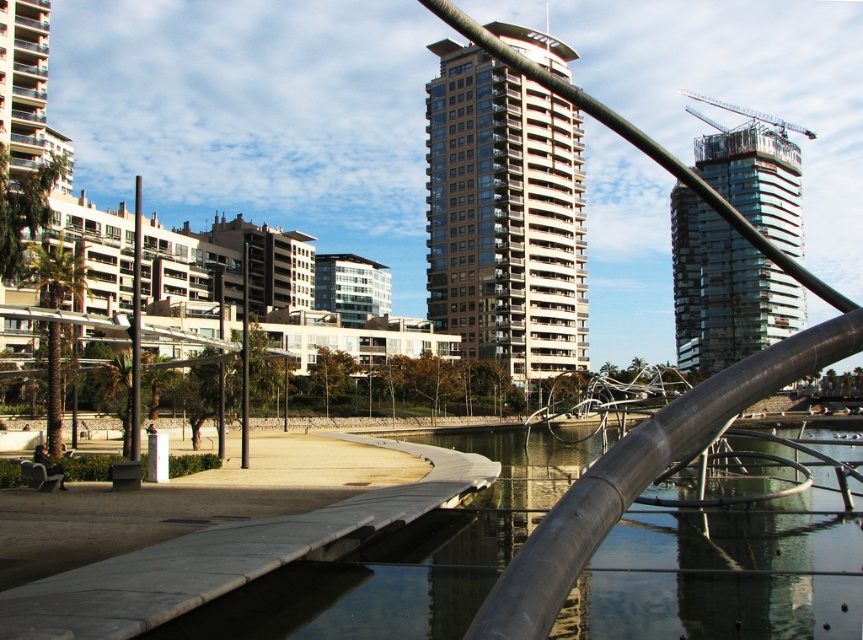
Question: Considering the real-world distances, which object is farthest from the beige glass building at center?

Choices:
 (A) metallic gray crane at upper right
 (B) black metal pole at center

Answer: (A)

Question: In this image, where is transparent glass tower at upper right located relative to metallic gray crane at upper right?

Choices:
 (A) above
 (B) below

Answer: (B)

Question: Which point is farther to the camera?

Choices:
 (A) smooth concrete river at center
 (B) beige glass building at center

Answer: (B)

Question: Which is nearer to the beige glass building at center?

Choices:
 (A) smooth concrete river at center
 (B) wooden bench at lower left

Answer: (A)

Question: Where is beige glass building at center located in relation to transparent glass tower at upper right in the image?

Choices:
 (A) right
 (B) left

Answer: (B)

Question: Is smooth concrete river at center further to the viewer compared to beige glass building at center?

Choices:
 (A) no
 (B) yes

Answer: (A)